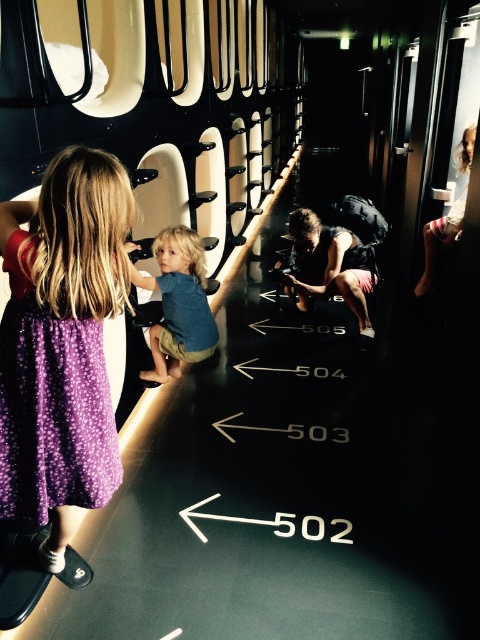
You are a passenger on the train and want to take a photo of both the purple dotted dress at left and the blue cotton shirt at center. Which one should you focus on first to ensure both are in the frame?

You should focus on the purple dotted dress at left first since it is closer to you than the blue cotton shirt at center, allowing both to be in the frame when adjusted properly.

You are a parent trying to navigate through the train corridor. You see the purple dotted dress at left and the blue cotton shirt at center. Which clothing item takes up more space in the corridor?

The purple dotted dress at left takes up more space in the corridor because its width is larger than the blue cotton shirt at center.